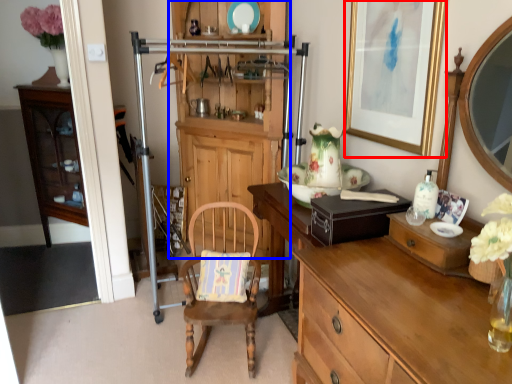
Question: Among these objects, which one is farthest to the camera, picture frame (highlighted by a red box) or cabinetry (highlighted by a blue box)?

Choices:
 (A) picture frame
 (B) cabinetry

Answer: (B)